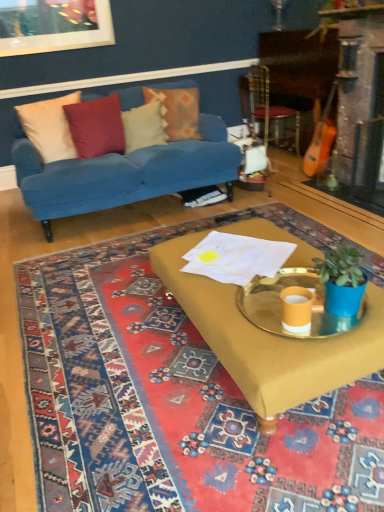
Identify the location of vacant space to the left of mustard fabric coffee table at center. (100, 346).